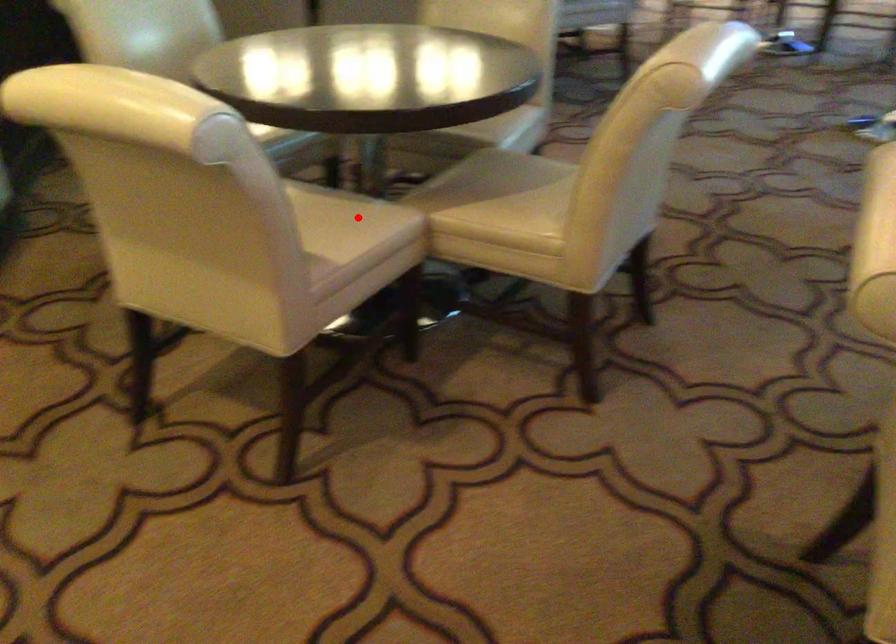
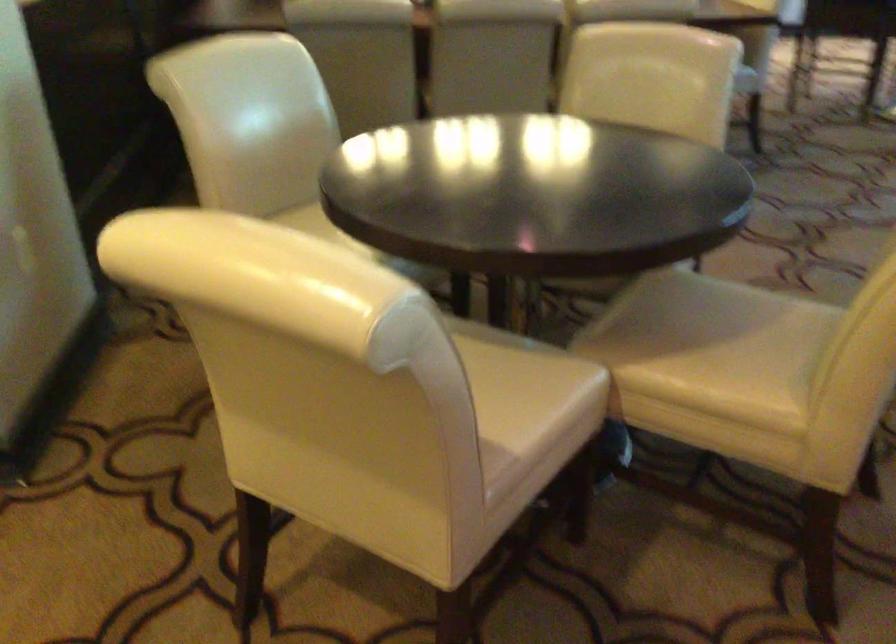
Question: I am providing you with two images of the same scene from different viewpoints. In image1, a red point is highlighted. Considering the same 3D point in image2, which of the following is correct?

Choices:
 (A) It is closer
 (B) It is farther

Answer: (A)